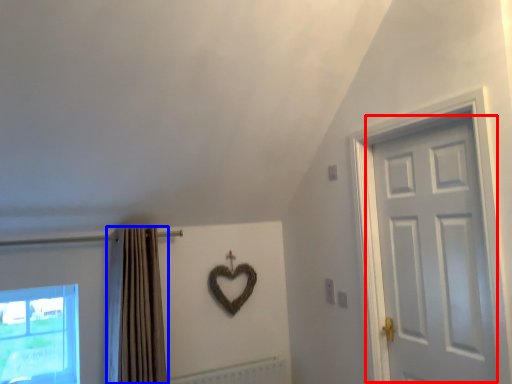
Question: Which object is closer to the camera taking this photo, door (highlighted by a red box) or curtain (highlighted by a blue box)?

Choices:
 (A) door
 (B) curtain

Answer: (A)